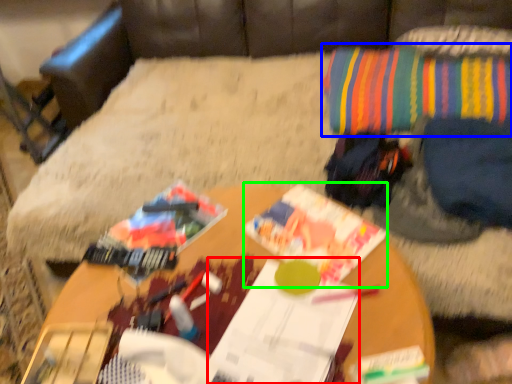
Question: Estimate the real-world distances between objects in this image. Which object is closer to magazine (highlighted by a red box), throw pillow (highlighted by a blue box) or magazine (highlighted by a green box)?

Choices:
 (A) throw pillow
 (B) magazine

Answer: (B)